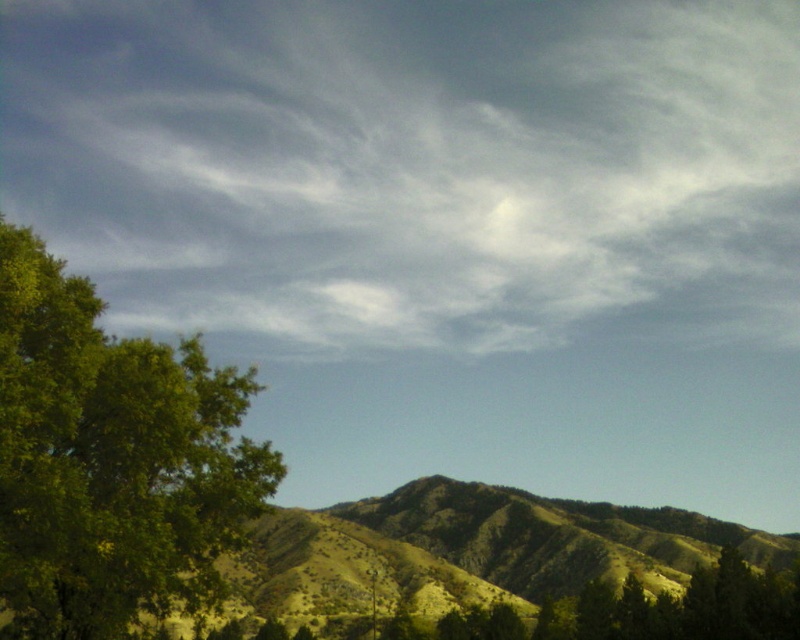
Which of these two, white fluffy cloud at upper center or green leafy tree at left, stands shorter?

green leafy tree at left

Is point (320, 346) closer to camera compared to point (124, 456)?

No, it is behind (124, 456).

You are a GUI agent. You are given a task and a screenshot of the screen. Output one action in this format:
    pyautogui.click(x=<x>, y=<y>)
    Task: Click on the white fluffy cloud at upper center
    The height and width of the screenshot is (640, 800).
    Given the screenshot: What is the action you would take?
    point(414,166)